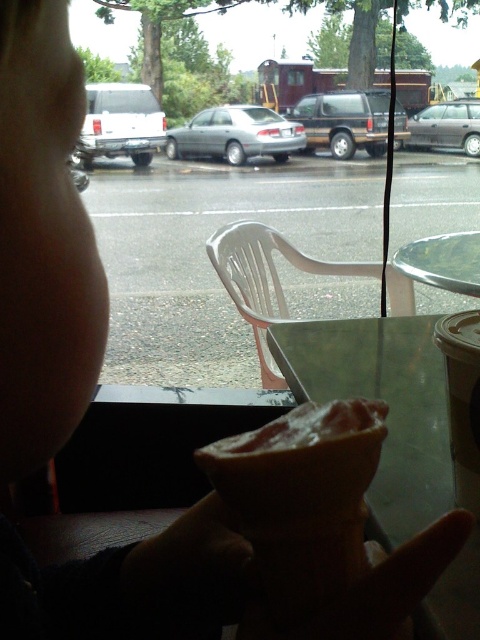
You are a customer at the cafe and want to know if the brown matte suv at center can fit through a narrow alley that the white matte van at left just passed through. Based on their sizes, what would you advise?

The brown matte suv at center is bigger than the white matte van at left, so it might not fit through the narrow alley that the white matte van at left just passed through. It would be safer to choose a different route.

You are a customer sitting at the white plastic chair near the window in the cafe. You notice two cars outside through the window. Which car is closer to you, the brown matte suv at center or the satin silver car at center?

The brown matte suv at center is closer to you because it is positioned above the satin silver car at center, indicating it is nearer in the visual plane.

You are a customer in the cafe and want to order the spongy pink cake at lower center. The server tells you that the cake is placed exactly at point [299,461] in the image. Where should you look to find the spongy pink cake at lower center?

The spongy pink cake at lower center is located at point [299,461] in the image.